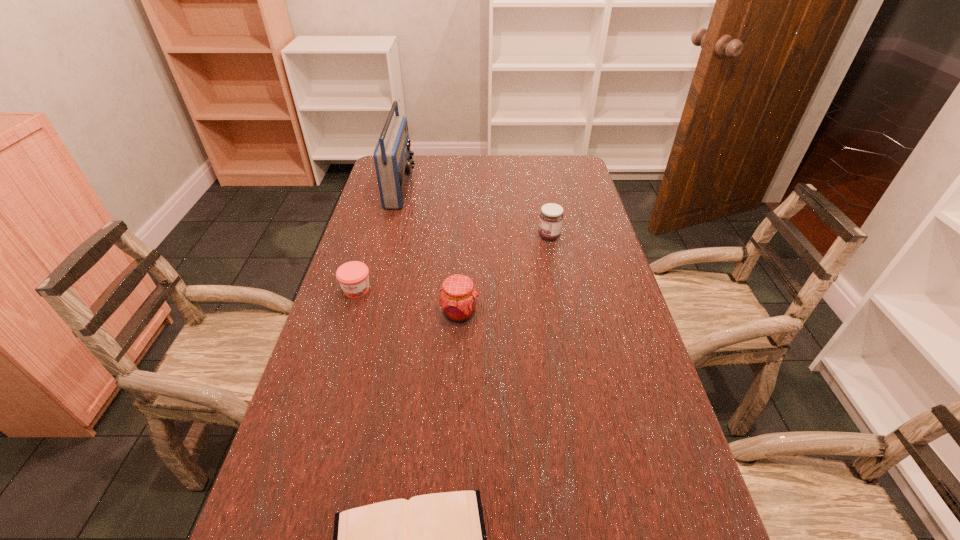
The height and width of the screenshot is (540, 960). I want to click on the tallest object, so click(x=393, y=161).

Where is `the farthest object`? the farthest object is located at coordinates (393, 161).

I want to click on the second jam from right to left, so click(457, 299).

Find the location of a particular element. The height and width of the screenshot is (540, 960). the rightmost object is located at coordinates (551, 216).

Where is `the rightmost jam`? The width and height of the screenshot is (960, 540). the rightmost jam is located at coordinates (551, 216).

I want to click on the leftmost jam, so click(353, 277).

Find the location of a particular element. The image size is (960, 540). the second shortest object is located at coordinates (353, 277).

Identify the location of free space located on the front panel of the farthest object. The height and width of the screenshot is (540, 960). (463, 188).

This screenshot has height=540, width=960. Identify the location of vacant space positioned 0.100m on the left of the second jam from right to left. (402, 314).

The width and height of the screenshot is (960, 540). What are the coordinates of `vacant area situated 0.140m on the front label of the rightmost jam` in the screenshot? It's located at (493, 236).